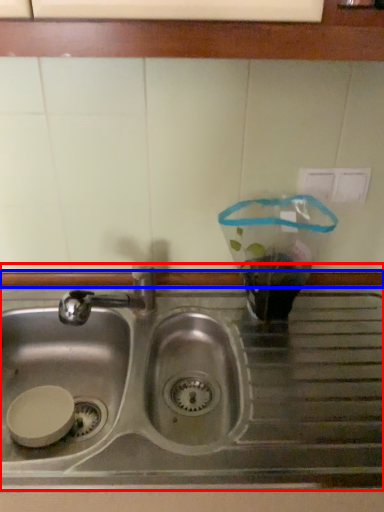
Question: Which object appears farthest to the camera in this image, sink (highlighted by a red box) or window sill (highlighted by a blue box)?

Choices:
 (A) sink
 (B) window sill

Answer: (B)